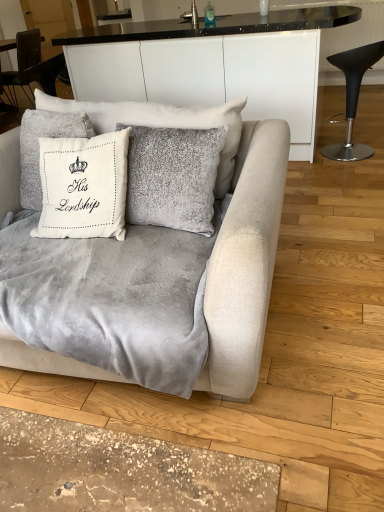
Question: Is there a large distance between velvet gray couch at center and black leather stool at right?

Choices:
 (A) yes
 (B) no

Answer: (A)

Question: Is velvet gray couch at center behind black leather stool at right?

Choices:
 (A) no
 (B) yes

Answer: (A)

Question: From a real-world perspective, is velvet gray couch at center over black leather stool at right?

Choices:
 (A) no
 (B) yes

Answer: (B)

Question: Considering the relative sizes of velvet gray couch at center and black leather stool at right in the image provided, is velvet gray couch at center shorter than black leather stool at right?

Choices:
 (A) no
 (B) yes

Answer: (A)

Question: Can you see velvet gray couch at center touching black leather stool at right?

Choices:
 (A) no
 (B) yes

Answer: (A)

Question: Is velvet gray blanket at center inside the boundaries of brushed metal faucet at upper center, or outside?

Choices:
 (A) outside
 (B) inside

Answer: (A)

Question: From a real-world perspective, is velvet gray blanket at center positioned above or below brushed metal faucet at upper center?

Choices:
 (A) below
 (B) above

Answer: (A)

Question: In terms of height, does velvet gray blanket at center look taller or shorter compared to brushed metal faucet at upper center?

Choices:
 (A) tall
 (B) short

Answer: (A)

Question: Considering the relative positions of velvet gray blanket at center and brushed metal faucet at upper center in the image provided, is velvet gray blanket at center to the left or to the right of brushed metal faucet at upper center?

Choices:
 (A) left
 (B) right

Answer: (A)

Question: Considering their positions, is white velvet cushion at upper center, arranged as the first pillow when viewed from the left, located in front of or behind white velvet cushion at center, positioned as the 1th pillow in right-to-left order?

Choices:
 (A) front
 (B) behind

Answer: (B)

Question: Is white velvet cushion at upper center, which ranks as the second pillow in right-to-left order, spatially inside white velvet cushion at center, marked as the 2th pillow in a left-to-right arrangement, or outside of it?

Choices:
 (A) inside
 (B) outside

Answer: (B)

Question: Considering the positions of white velvet cushion at upper center, which ranks as the second pillow in right-to-left order, and white velvet cushion at center, positioned as the 1th pillow in right-to-left order, in the image, is white velvet cushion at upper center, which ranks as the second pillow in right-to-left order, taller or shorter than white velvet cushion at center, positioned as the 1th pillow in right-to-left order,?

Choices:
 (A) tall
 (B) short

Answer: (B)

Question: From the image's perspective, relative to white velvet cushion at center, positioned as the 1th pillow in right-to-left order, is white velvet cushion at upper center, arranged as the first pillow when viewed from the left, above or below?

Choices:
 (A) above
 (B) below

Answer: (A)

Question: Looking at the image, does velvet gray couch at center seem bigger or smaller compared to black leather stool at right?

Choices:
 (A) big
 (B) small

Answer: (A)

Question: From their relative heights in the image, would you say velvet gray couch at center is taller or shorter than black leather stool at right?

Choices:
 (A) short
 (B) tall

Answer: (B)